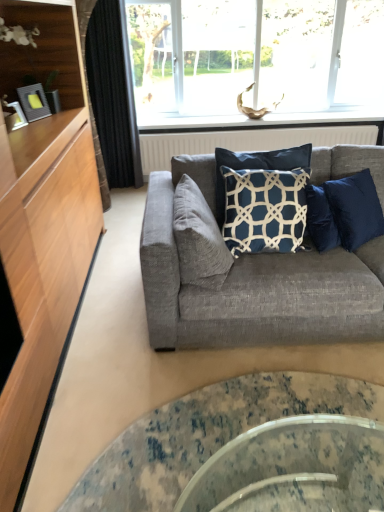
At what (x,y) coordinates should I click in order to perform the action: click on empty space that is ontop of white textured radiator at upper center (from a real-world perspective). Please return your answer as a coordinate pair (x, y). Looking at the image, I should click on (259, 126).